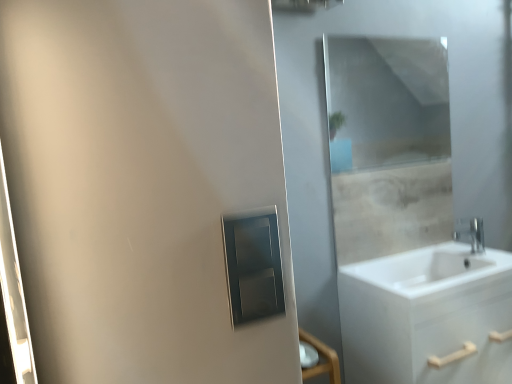
Question: Is silver metallic faucet at right to the left of clear glass mirror at upper center from the viewer's perspective?

Choices:
 (A) no
 (B) yes

Answer: (A)

Question: Does silver metallic faucet at right have a greater height compared to clear glass mirror at upper center?

Choices:
 (A) no
 (B) yes

Answer: (A)

Question: Is clear glass mirror at upper center located within silver metallic faucet at right?

Choices:
 (A) yes
 (B) no

Answer: (B)

Question: Does silver metallic faucet at right turn towards clear glass mirror at upper center?

Choices:
 (A) no
 (B) yes

Answer: (A)

Question: Are silver metallic faucet at right and clear glass mirror at upper center far apart?

Choices:
 (A) no
 (B) yes

Answer: (B)

Question: Is silver metallic faucet at right in front of clear glass mirror at upper center?

Choices:
 (A) no
 (B) yes

Answer: (A)

Question: From the image's perspective, does silver metallic faucet at right appear lower than white matte cabinet at lower right?

Choices:
 (A) yes
 (B) no

Answer: (B)

Question: Considering the relative sizes of silver metallic faucet at right and white matte cabinet at lower right in the image provided, is silver metallic faucet at right bigger than white matte cabinet at lower right?

Choices:
 (A) yes
 (B) no

Answer: (B)

Question: Can you confirm if silver metallic faucet at right is smaller than white matte cabinet at lower right?

Choices:
 (A) yes
 (B) no

Answer: (A)

Question: Is silver metallic faucet at right aimed at white matte cabinet at lower right?

Choices:
 (A) yes
 (B) no

Answer: (B)

Question: Considering the relative positions of silver metallic faucet at right and white matte cabinet at lower right in the image provided, is silver metallic faucet at right to the right of white matte cabinet at lower right from the viewer's perspective?

Choices:
 (A) yes
 (B) no

Answer: (A)

Question: Considering the relative sizes of silver metallic faucet at right and white matte cabinet at lower right in the image provided, is silver metallic faucet at right wider than white matte cabinet at lower right?

Choices:
 (A) yes
 (B) no

Answer: (B)

Question: Does silver metallic faucet at right have a greater height compared to matte silver medicine cabinet at center?

Choices:
 (A) yes
 (B) no

Answer: (B)